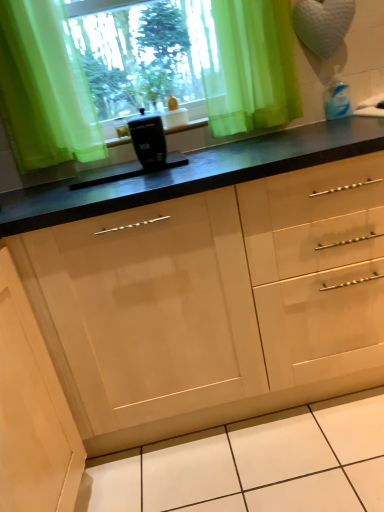
What do you see at coordinates (251, 67) in the screenshot? I see `translucent green curtain at upper center` at bounding box center [251, 67].

Locate an element on the screen. This screenshot has height=512, width=384. black plastic coffee maker at center is located at coordinates (148, 140).

Find the location of a particular element. black plastic container at center is located at coordinates (188, 126).

Find the location of a particular element. The image size is (384, 512). translucent green curtain at upper center is located at coordinates (251, 67).

Could you tell me if black plastic coffee maker at center is facing translucent green curtain at upper center?

No, black plastic coffee maker at center is not oriented towards translucent green curtain at upper center.

From their relative heights in the image, would you say black plastic coffee maker at center is taller or shorter than translucent green curtain at upper center?

In the image, black plastic coffee maker at center appears to be shorter than translucent green curtain at upper center.

Identify the location of curtain that appears on the right of black plastic coffee maker at center. (251, 67).

Considering the relative positions of black plastic coffee maker at center and translucent green curtain at upper center in the image provided, is black plastic coffee maker at center to the left or to the right of translucent green curtain at upper center?

Clearly, black plastic coffee maker at center is on the left of translucent green curtain at upper center in the image.

Which object is wider, black plastic container at center or translucent green curtain at upper center?

black plastic container at center.

Is black plastic container at center positioned with its back to translucent green curtain at upper center?

black plastic container at center is not turned away from translucent green curtain at upper center.

Is black plastic container at center directly adjacent to translucent green curtain at upper center?

No.

Between point (130, 140) and point (213, 74), which one is positioned in front?

The point (213, 74) is closer.

Who is shorter, black plastic container at center or matte wood cabinet at lower left?

black plastic container at center is shorter.

From a real-world perspective, which is physically below, black plastic container at center or matte wood cabinet at lower left?

From a 3D spatial view, matte wood cabinet at lower left is below.

Who is smaller, black plastic container at center or matte wood cabinet at lower left?

Smaller between the two is black plastic container at center.

Is matte wood cabinet at lower left at the back of black plastic container at center?

black plastic container at center is not turned away from matte wood cabinet at lower left.

From a real-world perspective, between translucent green curtain at upper center and black plastic container at center, who is vertically higher?

In real-world perspective, translucent green curtain at upper center is above.

Considering the positions of objects translucent green curtain at upper center and black plastic container at center in the image provided, who is more to the left, translucent green curtain at upper center or black plastic container at center?

From the viewer's perspective, black plastic container at center appears more on the left side.

Considering the relative sizes of translucent green curtain at upper center and black plastic container at center in the image provided, is translucent green curtain at upper center taller than black plastic container at center?

Correct, translucent green curtain at upper center is much taller as black plastic container at center.

Is translucent green curtain at upper center positioned beyond the bounds of black plastic container at center?

Yes, translucent green curtain at upper center is located beyond the bounds of black plastic container at center.

Looking at this image, considering the relative positions of black plastic coffee maker at center and green sheer curtain at upper center in the image provided, is black plastic coffee maker at center to the left of green sheer curtain at upper center from the viewer's perspective?

No.

Which object is further away from the camera taking this photo, black plastic coffee maker at center or green sheer curtain at upper center?

green sheer curtain at upper center is more distant.

From a real-world perspective, who is located lower, black plastic coffee maker at center or green sheer curtain at upper center?

black plastic coffee maker at center.

Is black plastic container at center oriented away from green sheer curtain at upper center?

No, black plastic container at center is not facing the opposite direction of green sheer curtain at upper center.

Is black plastic container at center spatially inside green sheer curtain at upper center, or outside of it?

black plastic container at center is enclosed within green sheer curtain at upper center.

Is black plastic container at center positioned far away from green sheer curtain at upper center?

black plastic container at center is actually quite close to green sheer curtain at upper center.

Considering the sizes of objects translucent green curtain at upper center and green sheer curtain at upper center in the image provided, who is shorter, translucent green curtain at upper center or green sheer curtain at upper center?

Standing shorter between the two is translucent green curtain at upper center.

Could you tell me if translucent green curtain at upper center is facing green sheer curtain at upper center?

No, translucent green curtain at upper center is not oriented towards green sheer curtain at upper center.

The height and width of the screenshot is (512, 384). In order to click on curtain in front of the green sheer curtain at upper center in this screenshot , I will do `click(251, 67)`.

Is translucent green curtain at upper center wider or thinner than green sheer curtain at upper center?

In the image, translucent green curtain at upper center appears to be more narrow than green sheer curtain at upper center.

Identify the location of appliance that is under the translucent green curtain at upper center (from a real-world perspective). This screenshot has width=384, height=512. (148, 140).

Locate an element on the screen. The height and width of the screenshot is (512, 384). window sill behind the translucent green curtain at upper center is located at coordinates (188, 126).

Looking at the image, which one is located closer to green sheer curtain at upper center, matte wood cabinet at lower left or translucent green curtain at upper center?

translucent green curtain at upper center.

Based on their spatial positions, is black plastic coffee maker at center or black plastic container at center closer to matte wood cabinet at lower left?

black plastic coffee maker at center lies closer to matte wood cabinet at lower left than the other object.

Based on their spatial positions, is translucent green curtain at upper center or green sheer curtain at upper center further from matte wood cabinet at lower left?

translucent green curtain at upper center.

Which object lies nearer to the anchor point green sheer curtain at upper center, translucent green curtain at upper center or black plastic container at center?

translucent green curtain at upper center is closer to green sheer curtain at upper center.

Estimate the real-world distances between objects in this image. Which object is further from matte wood cabinet at lower left, black plastic container at center or green sheer curtain at upper center?

green sheer curtain at upper center is positioned further to the anchor matte wood cabinet at lower left.

When comparing their distances from black plastic coffee maker at center, does translucent green curtain at upper center or black plastic container at center seem closer?

Among the two, black plastic container at center is located nearer to black plastic coffee maker at center.

Considering their positions, is black plastic container at center positioned further to translucent green curtain at upper center than matte wood cabinet at lower left?

matte wood cabinet at lower left is positioned further to the anchor translucent green curtain at upper center.

From the picture: When comparing their distances from green sheer curtain at upper center, does black plastic container at center or translucent green curtain at upper center seem further?

black plastic container at center.

I want to click on appliance that lies between green sheer curtain at upper center and matte wood cabinet at lower left from top to bottom, so click(x=148, y=140).

You are a GUI agent. You are given a task and a screenshot of the screen. Output one action in this format:
    pyautogui.click(x=<x>, y=<y>)
    Task: Click on the curtain between green sheer curtain at upper center and matte wood cabinet at lower left in the up-down direction
    
    Given the screenshot: What is the action you would take?
    pyautogui.click(x=251, y=67)

Where is `appliance between green sheer curtain at upper center and translucent green curtain at upper center from left to right`? The width and height of the screenshot is (384, 512). appliance between green sheer curtain at upper center and translucent green curtain at upper center from left to right is located at coordinates (148, 140).

Locate an element on the screen. The width and height of the screenshot is (384, 512). appliance between matte wood cabinet at lower left and black plastic container at center from front to back is located at coordinates (148, 140).